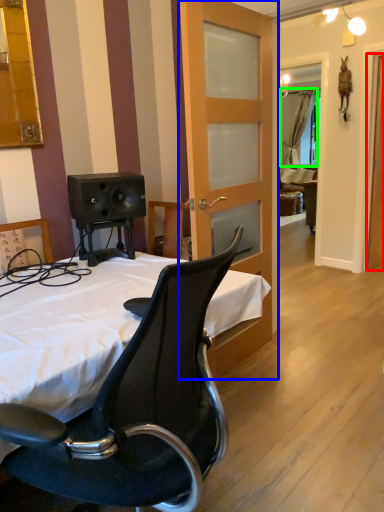
Question: Which is nearer to the screen door (highlighted by a red box)? door (highlighted by a blue box) or curtain (highlighted by a green box).

Choices:
 (A) door
 (B) curtain

Answer: (A)